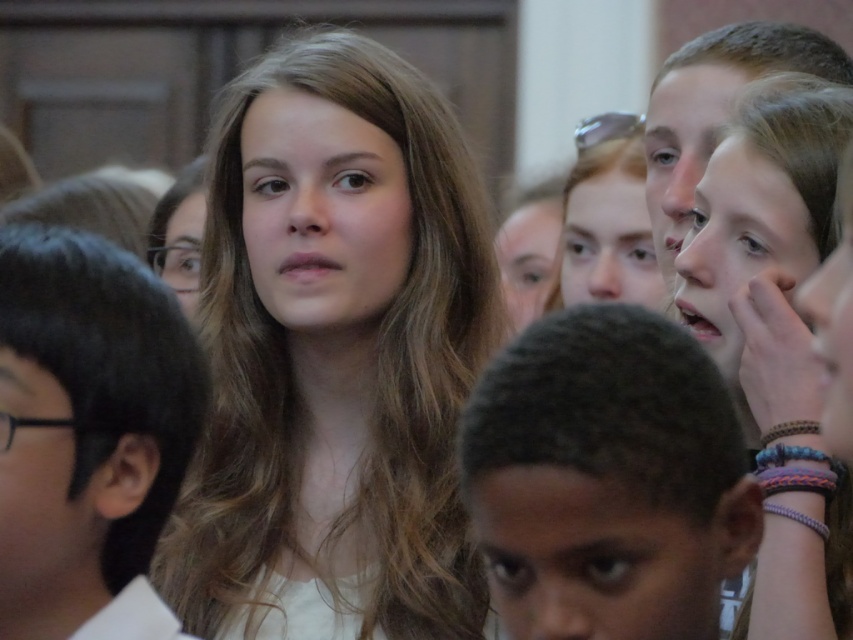
Based on the scene description, which object is taller between the smooth brown hair at center and the black hair at center?

The smooth brown hair at center is much taller than the black hair at center.

You are a photographer standing 2 meters away from the dark brown hair at center and black hair at center. You want to take a photo of both of them in the same frame. Can you position yourself so that both are visible without moving them? Explain your reasoning.

The dark brown hair at center is 1.27 meters away from the black hair at center. Since the photographer is already 2 meters away from both, the distance between them is small enough to fit within the camera frame. Therefore, positioning yourself appropriately should allow both to be visible in the same frame without needing to move them.

Based on the scene description, which object has a larger size between the smooth brown hair at center and the dark brown hair at center?

The smooth brown hair at center has a larger size compared to the dark brown hair at center according to the description.